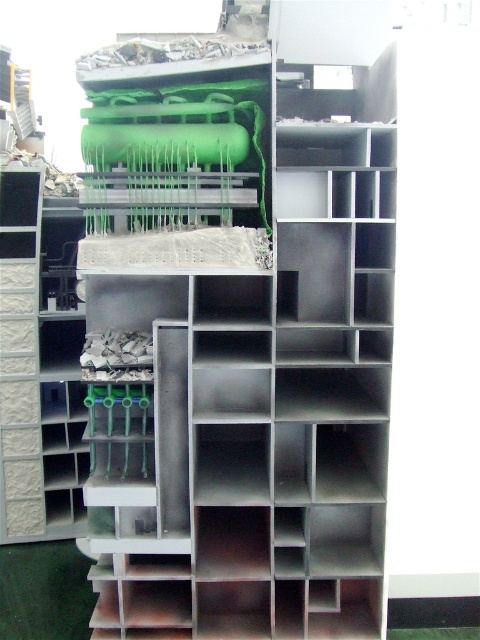
Is metallic gray bookshelf at center smaller than white textured brick at left?

Actually, metallic gray bookshelf at center might be larger than white textured brick at left.

Who is more distant from viewer, (x=322, y=403) or (x=76, y=381)?

Point (x=76, y=381)

At what (x,y) coordinates should I click in order to perform the action: click on metallic gray bookshelf at center. Please return your answer as a coordinate pair (x, y). Looking at the image, I should click on (233, 339).